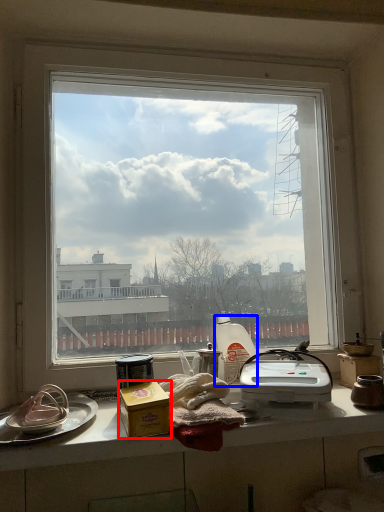
Question: Which of the following is the closest to the observer, appliance (highlighted by a red box) or appliance (highlighted by a blue box)?

Choices:
 (A) appliance
 (B) appliance

Answer: (A)